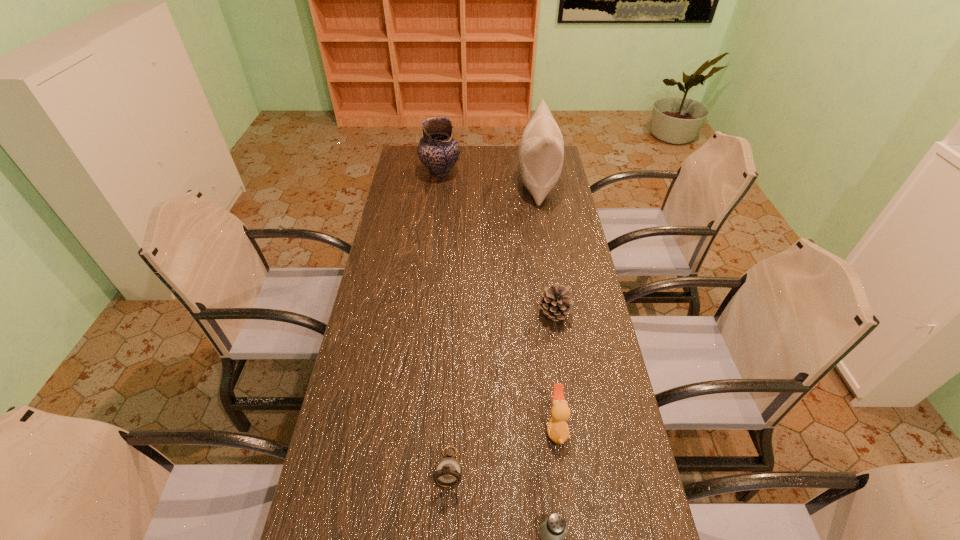
Locate which object ranks fifth in proximity to the pottery. Please provide its 2D coordinates. Your answer should be formatted as a tuple, i.e. [(x, y)], where the tuple contains the x and y coordinates of a point satisfying the conditions above.

[(553, 531)]

Locate which object is the fifth closest to the saltshaker. Please provide its 2D coordinates. Your answer should be formatted as a tuple, i.e. [(x, y)], where the tuple contains the x and y coordinates of a point satisfying the conditions above.

[(438, 151)]

I want to click on free space that satisfies the following two spatial constraints: 1. on the front side of the tallest object; 2. on the face of the compass, so click(585, 468).

Identify the location of free space that satisfies the following two spatial constraints: 1. on the front side of the tallest object; 2. on the face of the compass. This screenshot has height=540, width=960. (585, 468).